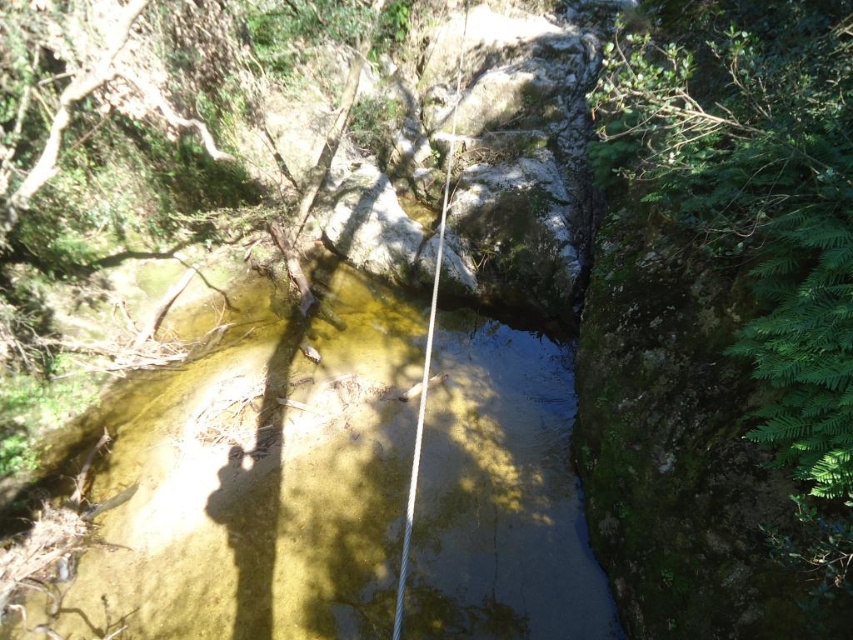
Question: Can you confirm if green mossy rock at right is positioned below white rope at center?

Choices:
 (A) yes
 (B) no

Answer: (A)

Question: Among these objects, which one is nearest to the camera?

Choices:
 (A) translucent yellowish water at center
 (B) green mossy rock at right

Answer: (B)

Question: Is green mossy rock at right to the left of white rope at center from the viewer's perspective?

Choices:
 (A) yes
 (B) no

Answer: (B)

Question: Which point is farther from the camera taking this photo?

Choices:
 (A) (735, 116)
 (B) (575, 513)

Answer: (B)

Question: Which is nearer to the translucent yellowish water at center?

Choices:
 (A) green mossy rock at right
 (B) white rope at center

Answer: (A)

Question: Does translucent yellowish water at center have a smaller size compared to green mossy rock at right?

Choices:
 (A) yes
 (B) no

Answer: (A)